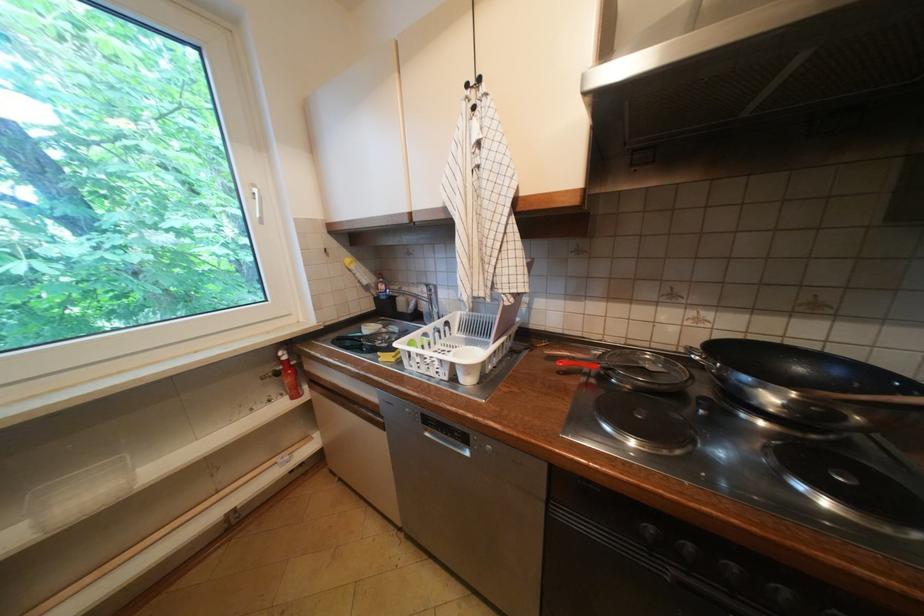
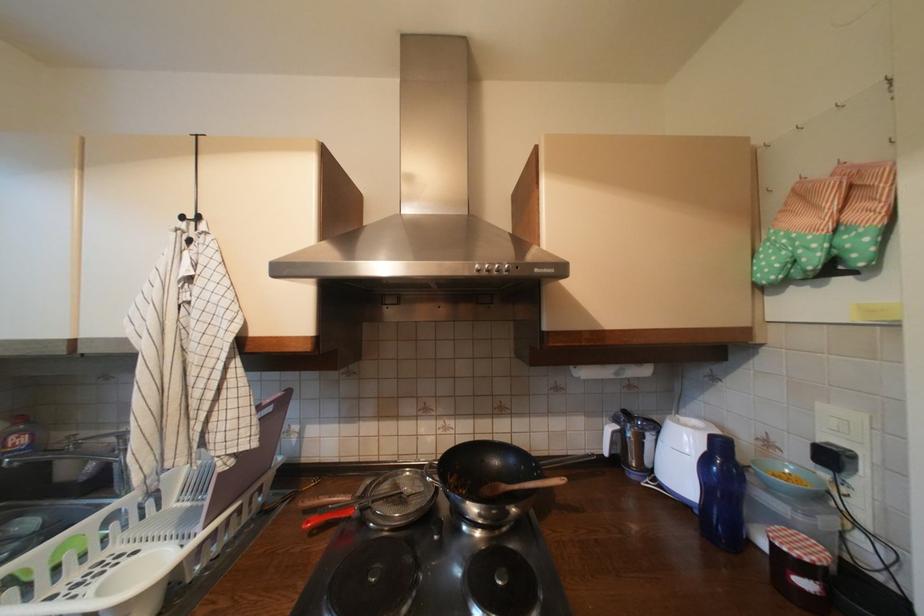
Where in the second image is the point corresponding to point 651,369 from the first image?

(410, 495)